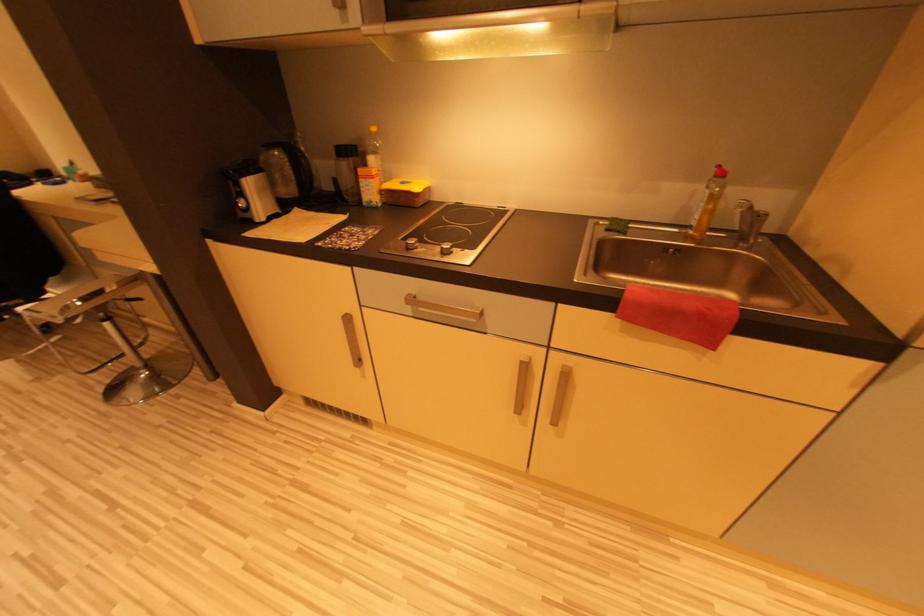
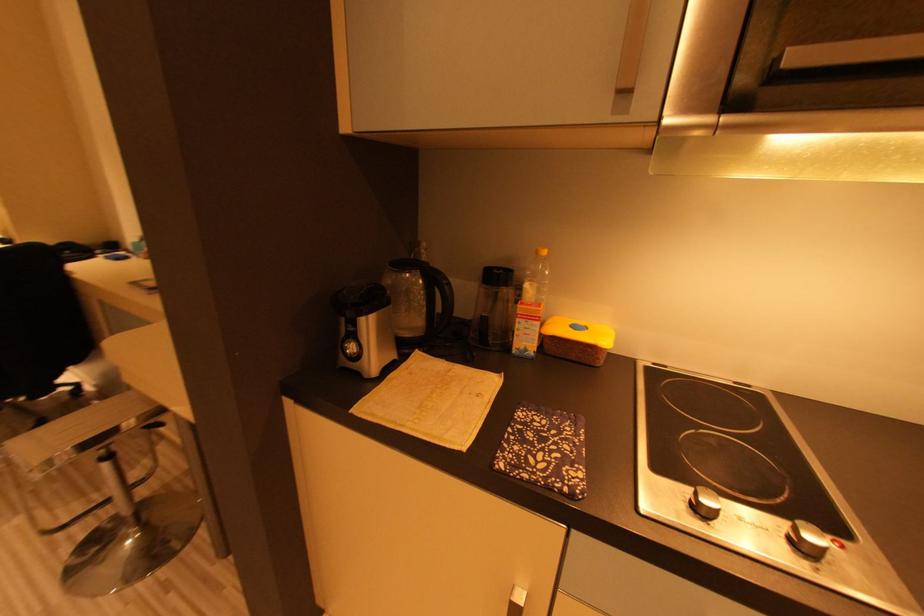
What movement of the cameraman would produce the second image?

The cameraman walked toward left, forward.